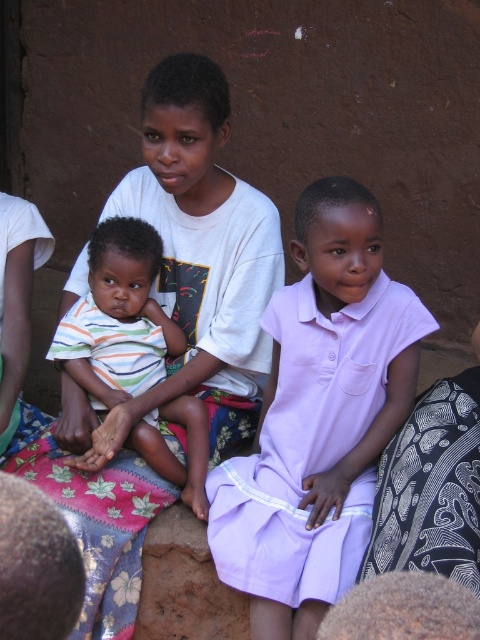
Question: Does lavender cotton dress at center have a greater width compared to striped cotton shirt at center?

Choices:
 (A) yes
 (B) no

Answer: (A)

Question: Which point is closer to the camera taking this photo?

Choices:
 (A) (179, 401)
 (B) (398, 285)

Answer: (B)

Question: Which point is farther to the camera?

Choices:
 (A) lavender cotton dress at center
 (B) striped cotton shirt at center

Answer: (B)

Question: Is lavender cotton dress at center below striped cotton shirt at center?

Choices:
 (A) yes
 (B) no

Answer: (A)

Question: From the image, what is the correct spatial relationship of lavender cotton dress at center in relation to striped cotton shirt at center?

Choices:
 (A) above
 (B) below

Answer: (B)